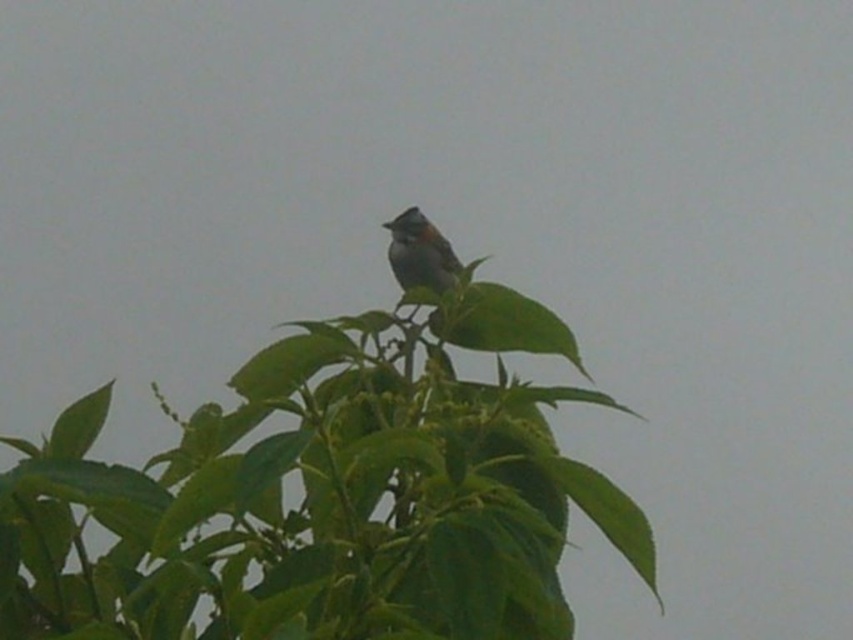
Does point (202, 458) come farther from viewer compared to point (427, 244)?

No.

Which is above, green leafy tree at upper center or brown speckled bird at center?

Positioned higher is brown speckled bird at center.

Which is behind, point (547, 525) or point (439, 234)?

The point (439, 234) is more distant.

Where is `green leafy tree at upper center`? green leafy tree at upper center is located at coordinates (326, 497).